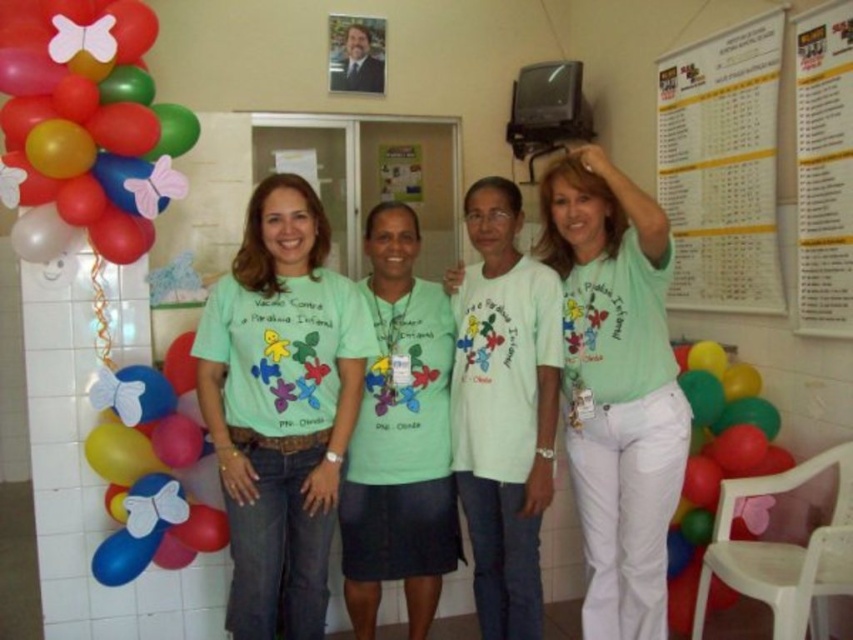
You are a photographer setting up for a group photo. You notice two sets of balloons labeled as multicolored glossy balloons at left and matte multicolored balloons at left. Which set of balloons is wider?

The multicolored glossy balloons at left are wider than the matte multicolored balloons at left.

You are a photographer trying to focus on the matte green shirt at center and the green matte shirt at center in the image. Which one should you adjust your camera to focus on first if you want to capture both clearly?

The matte green shirt at center is closer to the viewer than the green matte shirt at center. Therefore, you should focus on the matte green shirt at center first to ensure both are in focus.

You are a photographer setting up for a group photo. You need to ensure there is enough space between the green matte shirt at center and the matte multicolored balloons at left to avoid the balloons blocking the view of the shirt. The camera requires at least 25 inches of clearance between them. Based on the scene, will the current spacing work?

The green matte shirt at center is 24.99 inches from the matte multicolored balloons at left, which is just shy of the required 25 inches. The spacing is insufficient, so the balloons may slightly block the view of the shirt.